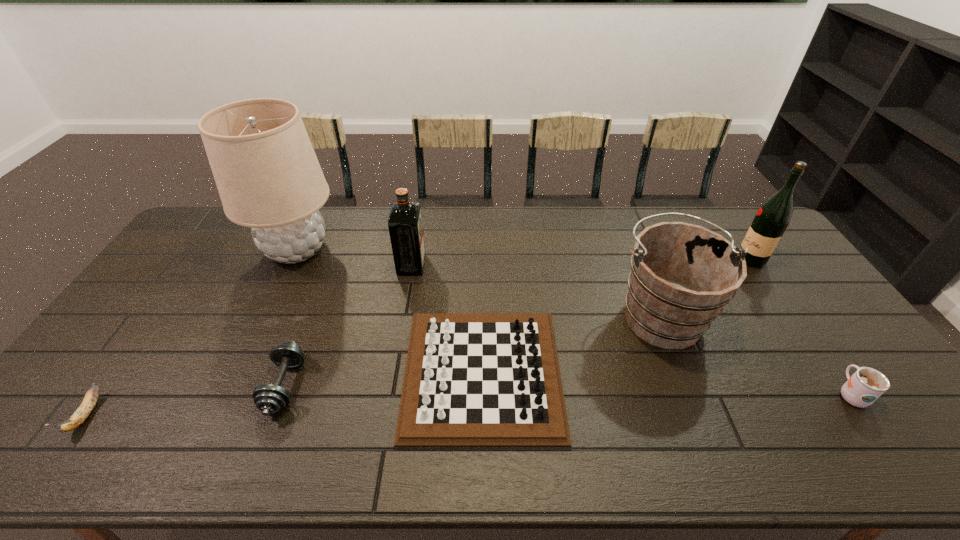
Where is `vacant space at the near edge`? This screenshot has width=960, height=540. vacant space at the near edge is located at coordinates 711,449.

In the image, there is a desktop. At what (x,y) coordinates should I click in order to perform the action: click on vacant space at the left edge. Please return your answer as a coordinate pair (x, y). The height and width of the screenshot is (540, 960). Looking at the image, I should click on (198, 247).

This screenshot has height=540, width=960. What are the coordinates of `vacant space at the right edge of the desktop` in the screenshot? It's located at (845, 368).

In the image, there is a desktop. Where is `vacant space at the far left corner`? This screenshot has height=540, width=960. vacant space at the far left corner is located at coordinates (229, 233).

I want to click on vacant space at the near left corner, so click(x=32, y=449).

The height and width of the screenshot is (540, 960). Identify the location of empty space that is in between the third object from right to left and the leftmost object. (374, 365).

Find the location of a particular element. empty space between the left liquor and the leftmost object is located at coordinates (250, 340).

Where is `vacant region between the leftmost object and the bucket`? Image resolution: width=960 pixels, height=540 pixels. vacant region between the leftmost object and the bucket is located at coordinates (374, 365).

In order to click on vacant area between the gameboard and the dumbbell in this screenshot , I will do `click(384, 379)`.

Image resolution: width=960 pixels, height=540 pixels. I want to click on free space between the cup and the tallest object, so click(573, 322).